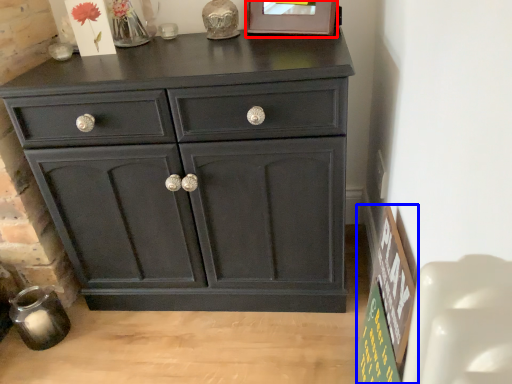
Question: Which point is closer to the camera, picture frame (highlighted by a red box) or bulletin board (highlighted by a blue box)?

Choices:
 (A) picture frame
 (B) bulletin board

Answer: (B)